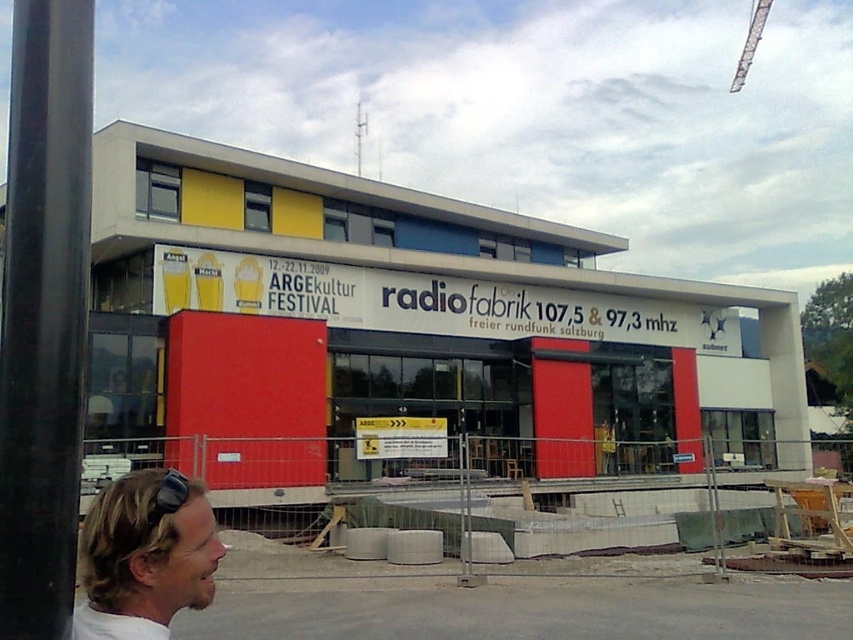
What do you see at coordinates (144, 556) in the screenshot? I see `white matte shirt at lower left` at bounding box center [144, 556].

Is point (122, 620) positioned before point (753, 36)?

Yes, it is in front of point (753, 36).

Who is more distant from viewer, (111, 492) or (751, 51)?

The point (751, 51) is behind.

At what (x,y) coordinates should I click in order to perform the action: click on white matte shirt at lower left. Please return your answer as a coordinate pair (x, y). The image size is (853, 640). Looking at the image, I should click on (144, 556).

From the picture: Is black metal pole at left smaller than white matte shirt at lower left?

No, black metal pole at left is not smaller than white matte shirt at lower left.

Does black metal pole at left have a greater width compared to white matte shirt at lower left?

Yes, black metal pole at left is wider than white matte shirt at lower left.

Is point (77, 333) farther from camera compared to point (170, 584)?

Yes, it is behind point (170, 584).

You are a GUI agent. You are given a task and a screenshot of the screen. Output one action in this format:
    pyautogui.click(x=<x>, y=<y>)
    Task: Click on the black metal pole at left
    The height and width of the screenshot is (640, 853).
    Given the screenshot: What is the action you would take?
    pyautogui.click(x=44, y=312)

Between point (35, 81) and point (741, 77), which one is positioned behind?

The point (741, 77) is more distant.

Does black metal pole at left have a lesser width compared to metallic silver crane at upper right?

Yes, black metal pole at left is thinner than metallic silver crane at upper right.

At what (x,y) coordinates should I click in order to perform the action: click on black metal pole at left. Please return your answer as a coordinate pair (x, y). Looking at the image, I should click on (44, 312).